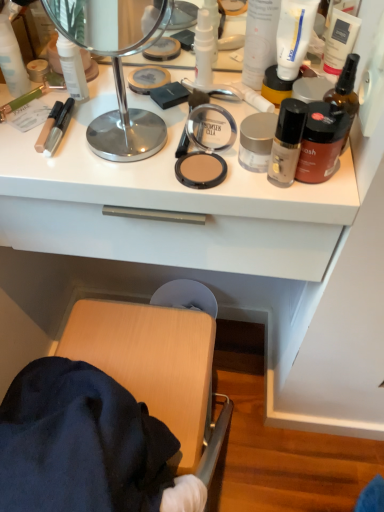
The image size is (384, 512). In order to click on vacant space that is in between matte brown compact at center and matte black concealer at left, which ranks as the ninth toiletry in right-to-left order in this screenshot , I will do `click(106, 153)`.